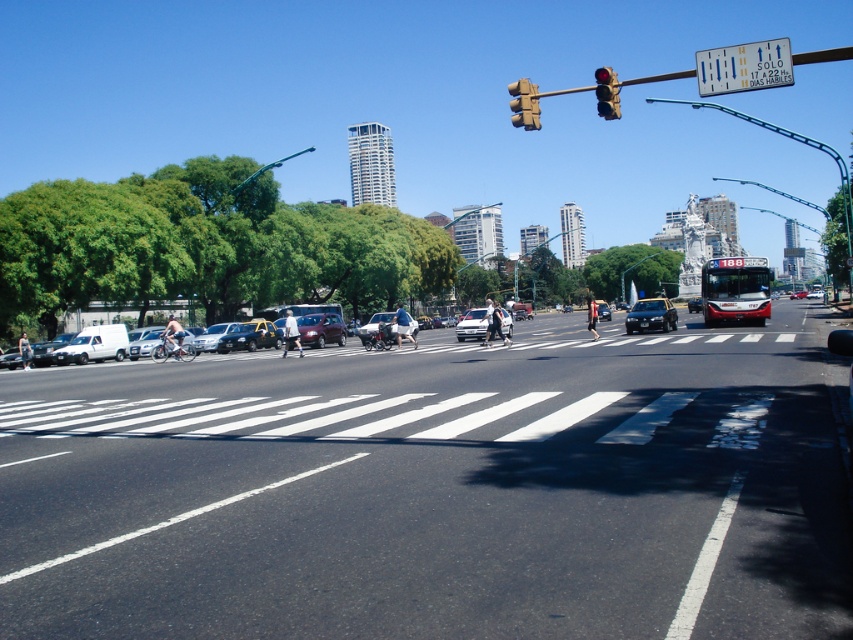
You are standing at the scene and want to cross the street to reach the white matte van at left. The crosswalk is 10 meters away from you. Can you safely reach the van before the traffic light turns red in 15 seconds?

The white matte van at left is 38.33 meters away from you. Since the crosswalk is only 10 meters away, you would need to walk an additional 28.33 meters after crossing. Assuming a walking speed of 1.5 m per second, it would take about 18.89 seconds, which exceeds the 15 seconds available. Therefore, you cannot safely reach the van before the traffic light turns red.

You are a delivery driver who needs to park your white matte van at left under the metallic traffic light at upper center. Can you safely park there without hitting the traffic light?

The white matte van at left has a lesser height compared to metallic traffic light at upper center, so yes, the van can park safely under the traffic light without hitting it.